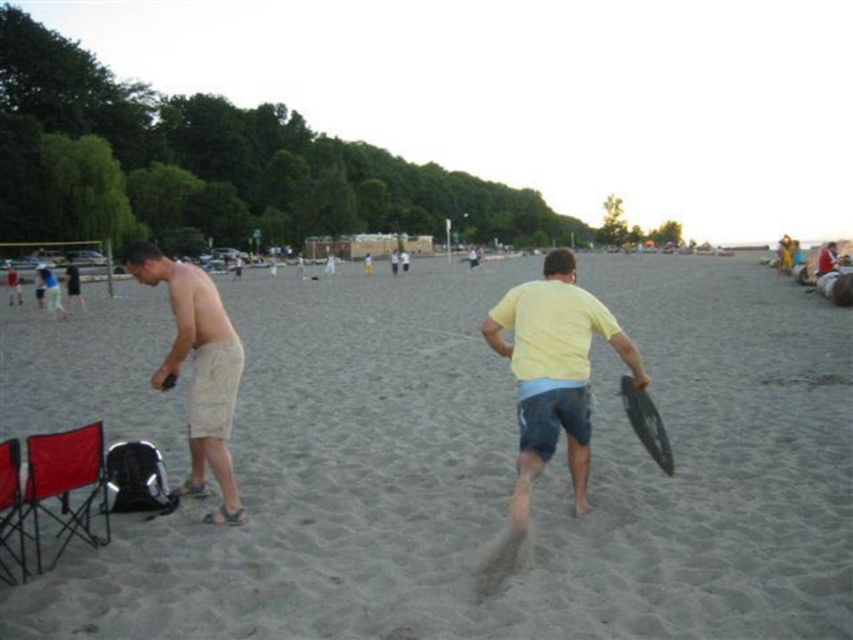
Does gray sand at center come in front of beige cotton shorts at left?

Yes, gray sand at center is in front of beige cotton shorts at left.

Does gray sand at center appear over beige cotton shorts at left?

Correct, gray sand at center is located above beige cotton shorts at left.

Is point (602, 624) positioned behind point (198, 310)?

No, (602, 624) is closer to viewer.

The image size is (853, 640). Identify the location of gray sand at center. (498, 474).

Between gray sand at center and yellow matte shirt at center, which one has less height?

yellow matte shirt at center

Who is positioned more to the right, gray sand at center or yellow matte shirt at center?

Answer: From the viewer's perspective, yellow matte shirt at center appears more on the right side.

Which is in front, point (448, 561) or point (511, 294)?

Point (448, 561)

Locate an element on the screen. The width and height of the screenshot is (853, 640). gray sand at center is located at coordinates (498, 474).

Is yellow matte shirt at center to the right of beige cotton shorts at left from the viewer's perspective?

Indeed, yellow matte shirt at center is positioned on the right side of beige cotton shorts at left.

From the picture: Can you confirm if yellow matte shirt at center is positioned above beige cotton shorts at left?

Correct, yellow matte shirt at center is located above beige cotton shorts at left.

Is point (593, 317) more distant than point (184, 273)?

No, it is in front of (184, 273).

Where is `yellow matte shirt at center`? The height and width of the screenshot is (640, 853). yellow matte shirt at center is located at coordinates (553, 371).